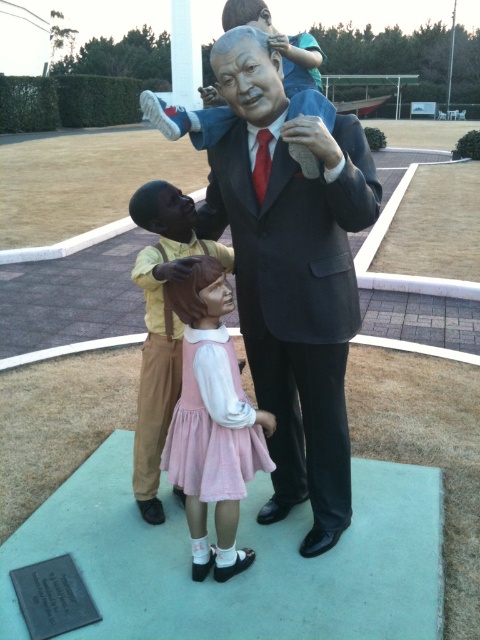
Question: Where is matte black suit at center located in relation to pink fabric dress at center in the image?

Choices:
 (A) right
 (B) left

Answer: (A)

Question: Which point is farther from the camera taking this photo?

Choices:
 (A) (224, 356)
 (B) (156, 285)

Answer: (B)

Question: Among these points, which one is farthest from the camera?

Choices:
 (A) (175, 314)
 (B) (317, 134)
 (C) (202, 340)

Answer: (A)

Question: Is matte black suit at center bigger than matte black statue at center?

Choices:
 (A) yes
 (B) no

Answer: (A)

Question: Which is farther from the pink fabric dress at center?

Choices:
 (A) matte black suit at center
 (B) matte black statue at center

Answer: (A)

Question: Does matte black suit at center have a lesser width compared to matte black statue at center?

Choices:
 (A) no
 (B) yes

Answer: (A)